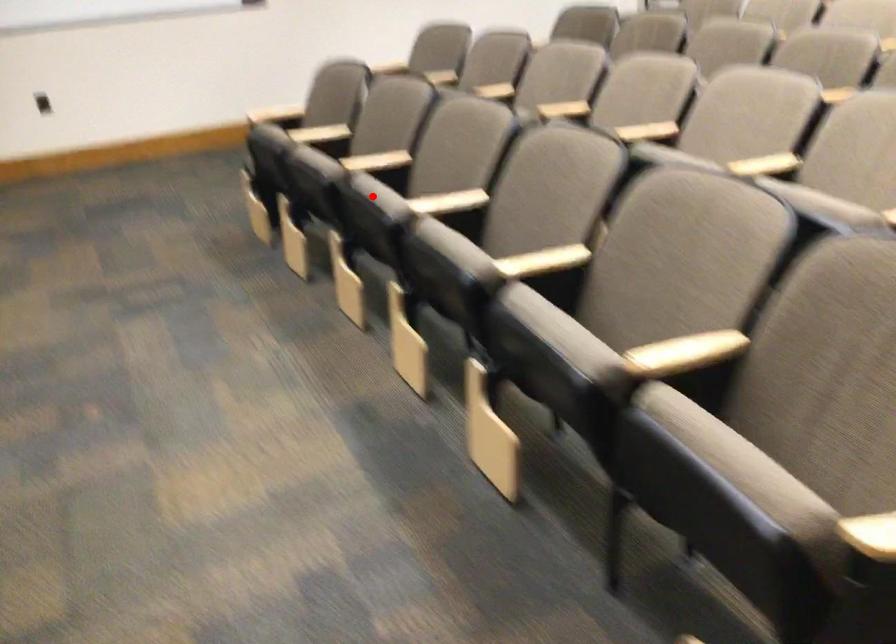
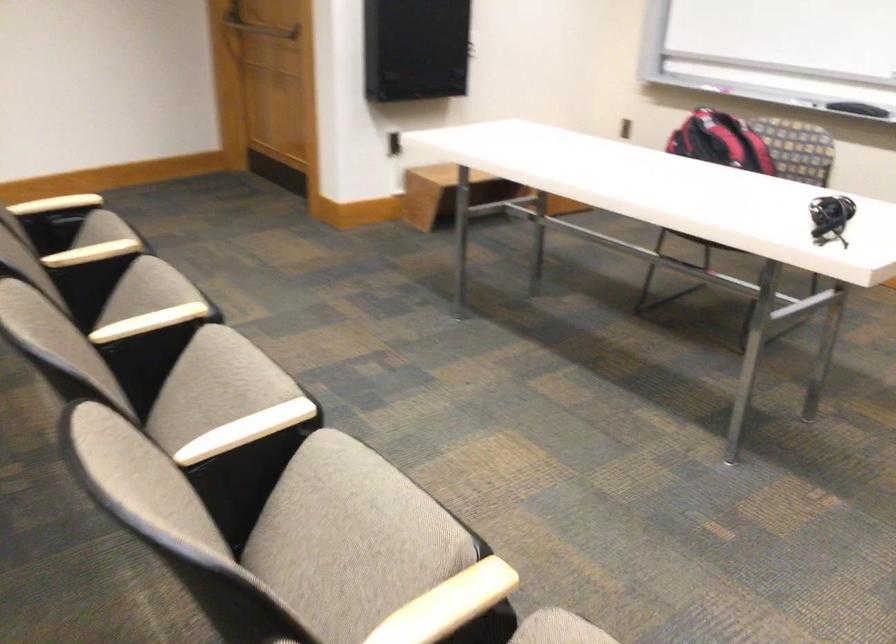
Question: I am providing you with two images of the same scene from different viewpoints. A red point is marked on the first image. Can you still see the location of the red point in image 2?

Choices:
 (A) Yes
 (B) No

Answer: (A)